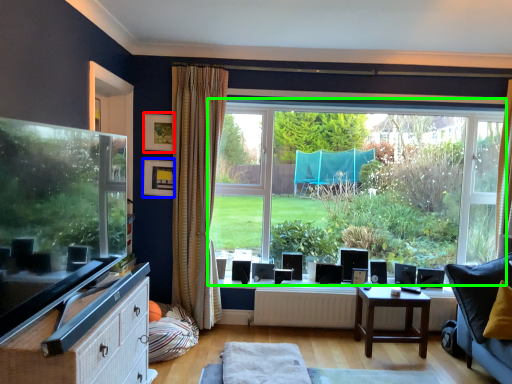
Question: Which object is the farthest from picture frame (highlighted by a red box)? Choose among these: picture frame (highlighted by a blue box) or window (highlighted by a green box).

Choices:
 (A) picture frame
 (B) window

Answer: (B)